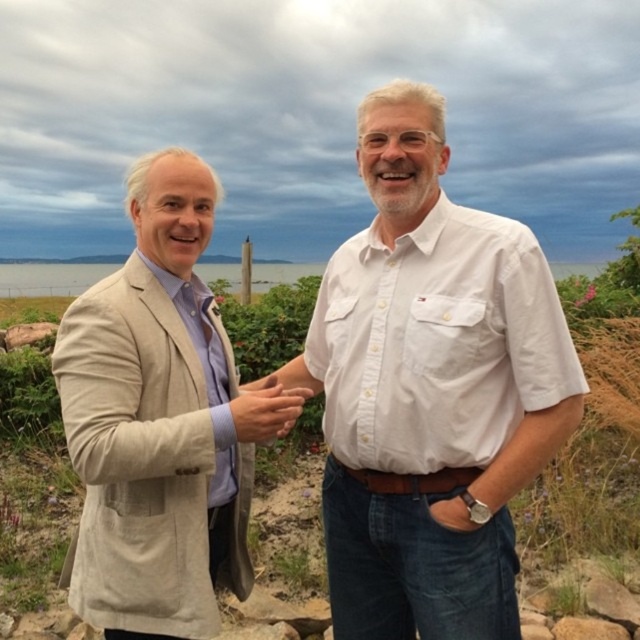
In the scene shown: You are a delivery drone that needs to fly from the person on the left to the person on the right. The transparent water at center is an obstacle. Can you safely navigate around it?

The transparent water at center is located at point (49, 278), so yes, the drone can safely navigate around it by adjusting its flight path to avoid the obstacle.

You are a photographer taking a photo of two people in a coastal setting. You notice the white cotton shirt at center and the matte beige hand at center. Which object is covering the other one?

The white cotton shirt at center is positioned over the matte beige hand at center, so the shirt is covering the hand.